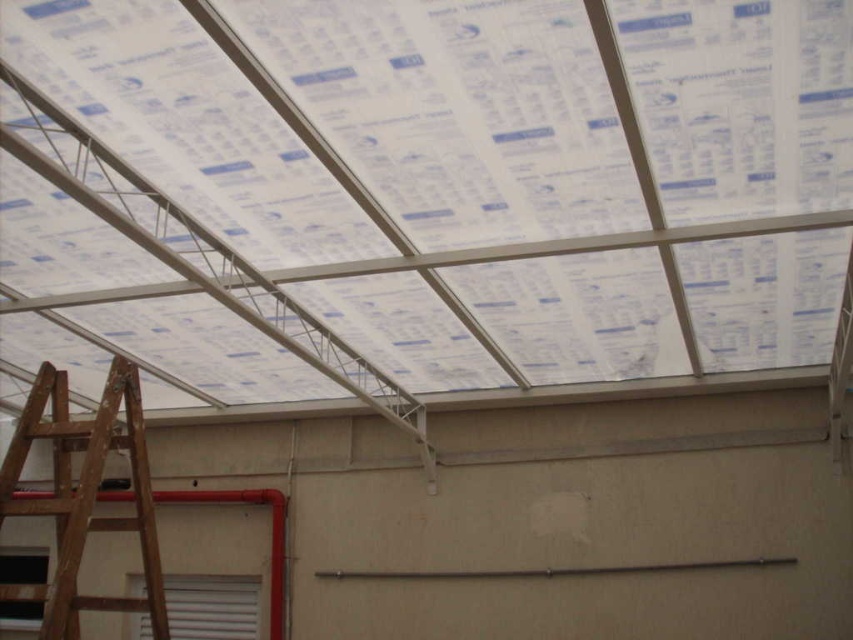
Which is in front, point (830, 90) or point (134, 451)?

Point (830, 90) is more forward.

Is transparent plastic roof at center in front of wooden ladder at lower left?

No, transparent plastic roof at center is further to the viewer.

This screenshot has height=640, width=853. Identify the location of transparent plastic roof at center. (426, 189).